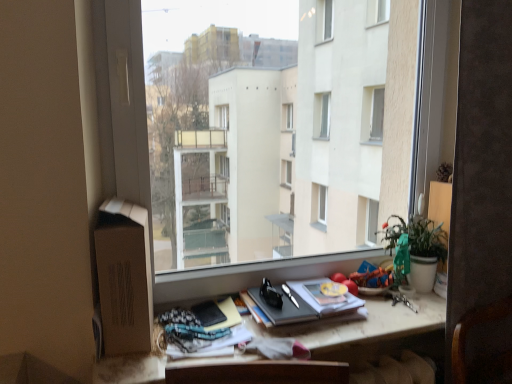
Question: Does green matte plant at right have a greater height compared to hardcover book at center, which ranks as the 1th paperback book in right-to-left order?

Choices:
 (A) no
 (B) yes

Answer: (B)

Question: From the image's perspective, does green matte plant at right appear higher than hardcover book at center, which is counted as the second paperback book, starting from the left?

Choices:
 (A) no
 (B) yes

Answer: (B)

Question: Would you say green matte plant at right is outside hardcover book at center, which is counted as the second paperback book, starting from the left?

Choices:
 (A) no
 (B) yes

Answer: (B)

Question: Can you confirm if green matte plant at right is shorter than hardcover book at center, which is counted as the second paperback book, starting from the left?

Choices:
 (A) yes
 (B) no

Answer: (B)

Question: Does green matte plant at right touch hardcover book at center, which is counted as the second paperback book, starting from the left?

Choices:
 (A) no
 (B) yes

Answer: (A)

Question: Looking at the image, does hardcover book at center, which is counted as the second paperback book, starting from the left, seem bigger or smaller compared to transparent glass window at center?

Choices:
 (A) big
 (B) small

Answer: (B)

Question: Is point (303, 309) positioned closer to the camera than point (282, 66)?

Choices:
 (A) farther
 (B) closer

Answer: (B)

Question: From a real-world perspective, relative to transparent glass window at center, is hardcover book at center, which ranks as the 1th paperback book in right-to-left order, vertically above or below?

Choices:
 (A) below
 (B) above

Answer: (A)

Question: From the image's perspective, is hardcover book at center, which ranks as the 1th paperback book in right-to-left order, above or below transparent glass window at center?

Choices:
 (A) below
 (B) above

Answer: (A)

Question: From the image's perspective, is matte black notebook at lower center, positioned as the second paperback book in right-to-left order, above or below green matte plant at right?

Choices:
 (A) below
 (B) above

Answer: (A)

Question: In the image, is matte black notebook at lower center, positioned as the second paperback book in right-to-left order, positioned in front of or behind green matte plant at right?

Choices:
 (A) behind
 (B) front

Answer: (B)

Question: Is point (210, 306) positioned closer to the camera than point (410, 264)?

Choices:
 (A) closer
 (B) farther

Answer: (A)

Question: Considering the positions of matte black notebook at lower center, the 1th paperback book in the left-to-right sequence, and green matte plant at right in the image, is matte black notebook at lower center, the 1th paperback book in the left-to-right sequence, wider or thinner than green matte plant at right?

Choices:
 (A) thin
 (B) wide

Answer: (A)

Question: Is matte black notebook at lower center, the 1th paperback book in the left-to-right sequence, spatially inside matte wooden desk at center, or outside of it?

Choices:
 (A) inside
 (B) outside

Answer: (A)

Question: From the image's perspective, is matte black notebook at lower center, the 1th paperback book in the left-to-right sequence, located above or below matte wooden desk at center?

Choices:
 (A) below
 (B) above

Answer: (B)